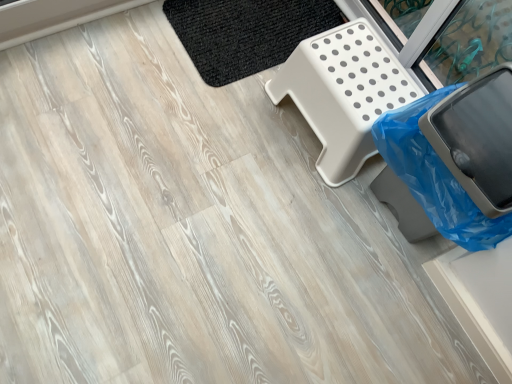
I want to click on free space between blue plastic trash can at lower right and white plastic step stool at upper right, so click(356, 213).